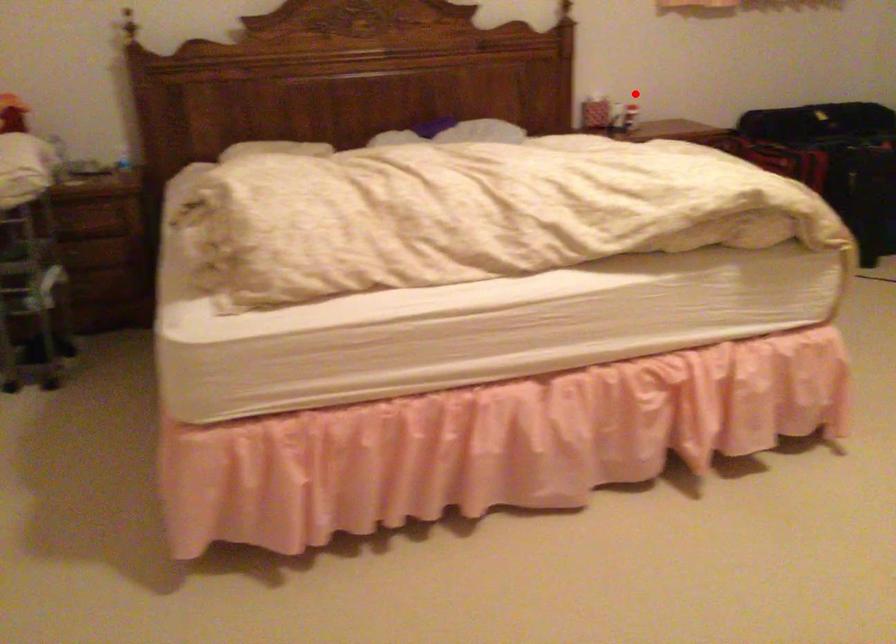
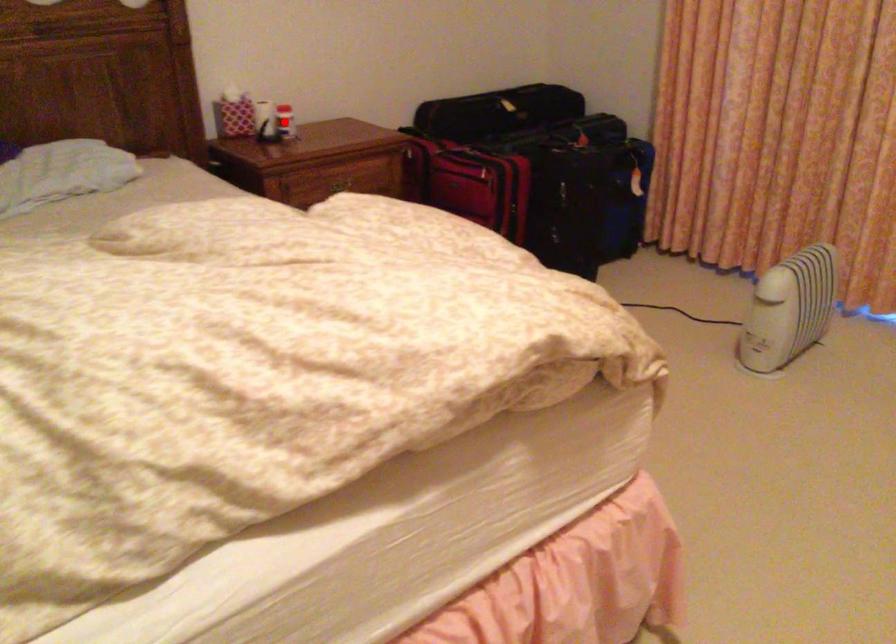
I am providing you with two images of the same scene from different viewpoints. A red point is marked on the first image and another point is marked on the second image. Is the red point in image1 aligned with the point shown in image2?

Yes